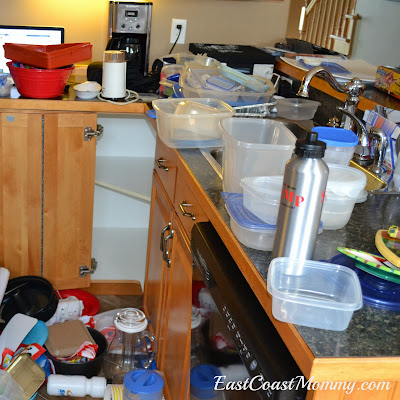
Where is `dishwasher`? dishwasher is located at coordinates (201, 301).